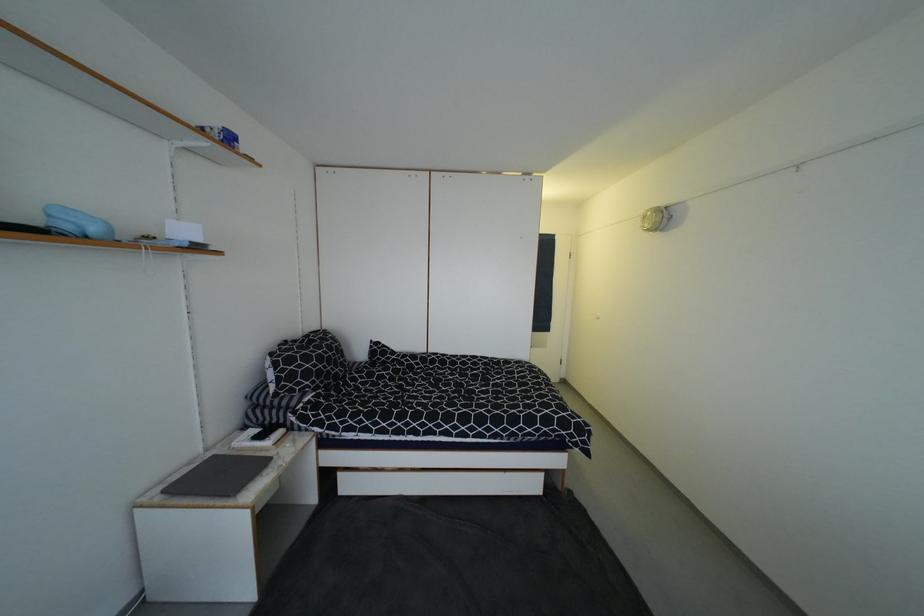
This screenshot has width=924, height=616. I want to click on blue tissue box, so click(222, 135).